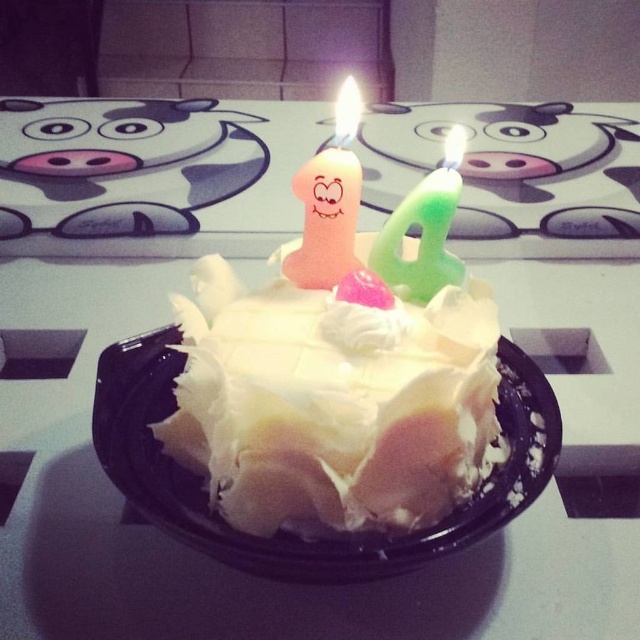
Can you confirm if white frosted cake at center is positioned to the right of white matte plate at center?

Indeed, white frosted cake at center is positioned on the right side of white matte plate at center.

Between white frosted cake at center and white matte plate at center, which one is positioned lower?

Positioned lower is white matte plate at center.

Is point (212, 346) less distant than point (528, 365)?

That is True.

The image size is (640, 640). Find the location of `white frosted cake at center`. white frosted cake at center is located at coordinates (340, 364).

Who is more distant from viewer, (531, 496) or (310, 246)?

The point (310, 246) is behind.

At what (x,y) coordinates should I click in order to perform the action: click on white matte plate at center. Please return your answer as a coordinate pair (x, y). Looking at the image, I should click on (289, 531).

The width and height of the screenshot is (640, 640). Find the location of `white matte plate at center`. white matte plate at center is located at coordinates (289, 531).

Locate an element on the screen. white frosted cake at center is located at coordinates (340, 364).

What do you see at coordinates (340, 364) in the screenshot? Image resolution: width=640 pixels, height=640 pixels. I see `white frosted cake at center` at bounding box center [340, 364].

Which is behind, point (342, 244) or point (332, 192)?

Positioned behind is point (342, 244).

Where is `white frosted cake at center`? white frosted cake at center is located at coordinates coord(340,364).